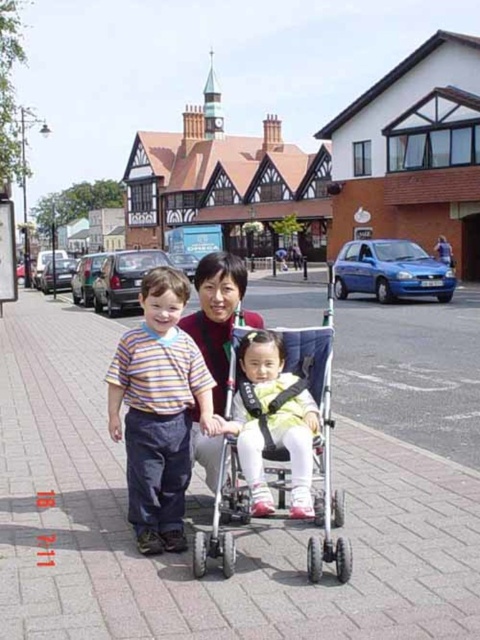
Question: Which of the following is the farthest from the observer?

Choices:
 (A) striped cotton shirt at left
 (B) light yellow fabric dress at center
 (C) light blue fabric stroller at center
 (D) brick pavement at center

Answer: (A)

Question: Can you confirm if striped cotton shirt at left is bigger than light yellow fabric dress at center?

Choices:
 (A) yes
 (B) no

Answer: (A)

Question: Where is brick pavement at center located in relation to light blue fabric stroller at center in the image?

Choices:
 (A) above
 (B) below

Answer: (B)

Question: Estimate the real-world distances between objects in this image. Which object is closer to the light blue fabric stroller at center?

Choices:
 (A) light yellow fabric dress at center
 (B) brick pavement at center

Answer: (A)

Question: Does brick pavement at center have a larger size compared to striped cotton shirt at left?

Choices:
 (A) no
 (B) yes

Answer: (B)

Question: Which point is farther to the camera?

Choices:
 (A) [x=272, y=436]
 (B) [x=295, y=374]
 (C) [x=205, y=582]
 (D) [x=167, y=499]

Answer: (B)